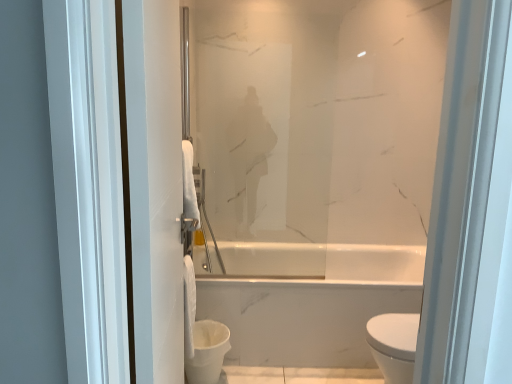
Question: Is white fluffy toilet paper at center looking in the opposite direction of white glossy toilet bowl at lower center?

Choices:
 (A) no
 (B) yes

Answer: (A)

Question: Would you say white glossy toilet bowl at lower center is part of white fluffy toilet paper at center's contents?

Choices:
 (A) no
 (B) yes

Answer: (A)

Question: From a real-world perspective, is white fluffy toilet paper at center located beneath white glossy toilet bowl at lower center?

Choices:
 (A) yes
 (B) no

Answer: (B)

Question: From the image's perspective, is white fluffy toilet paper at center located beneath white glossy toilet bowl at lower center?

Choices:
 (A) yes
 (B) no

Answer: (B)

Question: Can you confirm if white fluffy toilet paper at center is wider than white glossy toilet bowl at lower center?

Choices:
 (A) yes
 (B) no

Answer: (B)

Question: Is white fluffy toilet paper at center thinner than white glossy toilet bowl at lower center?

Choices:
 (A) no
 (B) yes

Answer: (B)

Question: Considering the relative sizes of white glossy toilet bowl at lower center and satin glass mirror at center in the image provided, is white glossy toilet bowl at lower center taller than satin glass mirror at center?

Choices:
 (A) no
 (B) yes

Answer: (A)

Question: Considering the relative positions of white glossy toilet bowl at lower center and satin glass mirror at center in the image provided, is white glossy toilet bowl at lower center to the left of satin glass mirror at center from the viewer's perspective?

Choices:
 (A) yes
 (B) no

Answer: (A)

Question: From a real-world perspective, is white glossy toilet bowl at lower center under satin glass mirror at center?

Choices:
 (A) no
 (B) yes

Answer: (B)

Question: Is white glossy toilet bowl at lower center to the right of satin glass mirror at center from the viewer's perspective?

Choices:
 (A) no
 (B) yes

Answer: (A)

Question: Is white glossy toilet bowl at lower center aimed at satin glass mirror at center?

Choices:
 (A) yes
 (B) no

Answer: (B)

Question: From a real-world perspective, is white glossy toilet bowl at lower center physically above satin glass mirror at center?

Choices:
 (A) no
 (B) yes

Answer: (A)

Question: From the image's perspective, is satin glass mirror at center beneath white fluffy toilet paper at center?

Choices:
 (A) yes
 (B) no

Answer: (B)